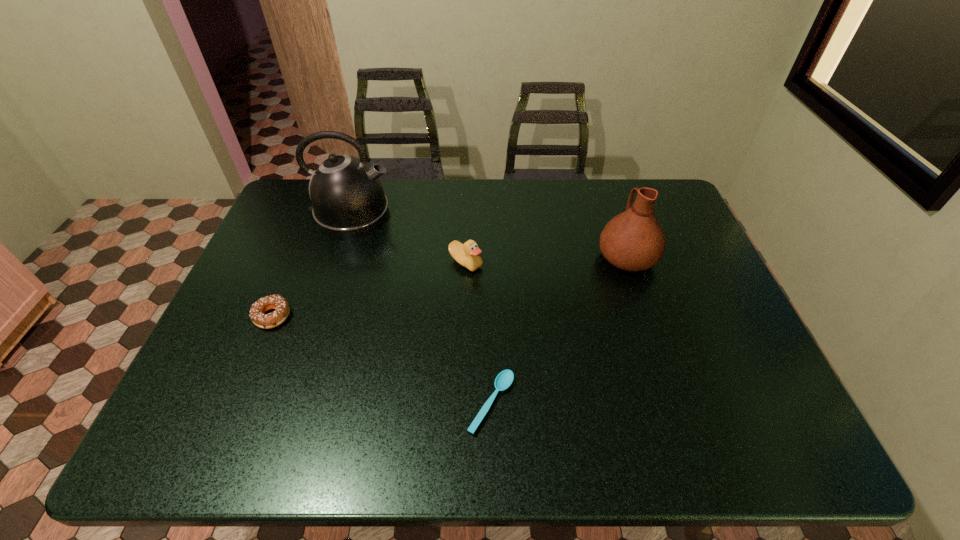
Identify the location of object present at the far left corner. (347, 196).

Locate an element on the screen. vacant space at the far edge of the desktop is located at coordinates (497, 214).

Where is `blank space at the near edge of the desktop`? blank space at the near edge of the desktop is located at coordinates (464, 420).

Locate an element on the screen. This screenshot has height=540, width=960. vacant space at the left edge of the desktop is located at coordinates (302, 232).

The image size is (960, 540). I want to click on free space at the right edge, so click(726, 386).

In the image, there is a desktop. Identify the location of vacant space at the far right corner. This screenshot has width=960, height=540. (632, 180).

The height and width of the screenshot is (540, 960). In the image, there is a desktop. Identify the location of vacant space at the near right corner. (782, 442).

This screenshot has height=540, width=960. In order to click on vacant region between the tallest object and the shortest object in this screenshot , I will do `click(421, 308)`.

Identify the location of vacant area between the third tallest object and the spoon. Image resolution: width=960 pixels, height=540 pixels. (479, 333).

This screenshot has height=540, width=960. I want to click on vacant region between the kettle and the fourth shortest object, so click(489, 235).